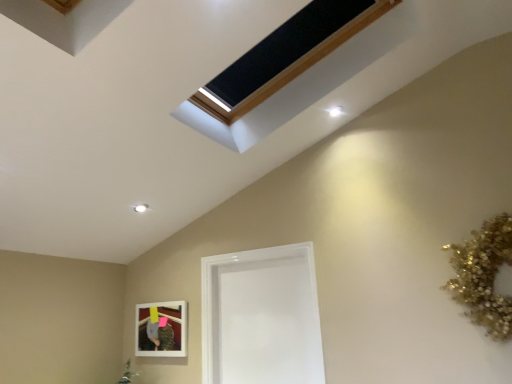
Question: Can you confirm if matte white picture frame at lower left is bigger than transparent glass door at center?

Choices:
 (A) yes
 (B) no

Answer: (B)

Question: From the image's perspective, does matte white picture frame at lower left appear higher than transparent glass door at center?

Choices:
 (A) yes
 (B) no

Answer: (B)

Question: Could you tell me if matte white picture frame at lower left is facing transparent glass door at center?

Choices:
 (A) no
 (B) yes

Answer: (A)

Question: Does matte white picture frame at lower left touch transparent glass door at center?

Choices:
 (A) no
 (B) yes

Answer: (A)

Question: Is matte white picture frame at lower left outside of transparent glass door at center?

Choices:
 (A) no
 (B) yes

Answer: (B)

Question: Would you say matte white picture frame at lower left contains transparent glass door at center?

Choices:
 (A) yes
 (B) no

Answer: (B)

Question: From a real-world perspective, is transparent glass door at center located higher than matte white picture frame at lower left?

Choices:
 (A) yes
 (B) no

Answer: (A)

Question: Does transparent glass door at center have a greater height compared to matte white picture frame at lower left?

Choices:
 (A) no
 (B) yes

Answer: (B)

Question: Is transparent glass door at center surrounding matte white picture frame at lower left?

Choices:
 (A) no
 (B) yes

Answer: (A)

Question: From the image's perspective, is transparent glass door at center over matte white picture frame at lower left?

Choices:
 (A) yes
 (B) no

Answer: (A)

Question: Can you confirm if transparent glass door at center is smaller than matte white picture frame at lower left?

Choices:
 (A) yes
 (B) no

Answer: (B)

Question: From the image's perspective, is transparent glass door at center under matte white picture frame at lower left?

Choices:
 (A) yes
 (B) no

Answer: (B)

Question: In the image, is matte white picture frame at lower left on the left side or the right side of transparent glass door at center?

Choices:
 (A) right
 (B) left

Answer: (B)